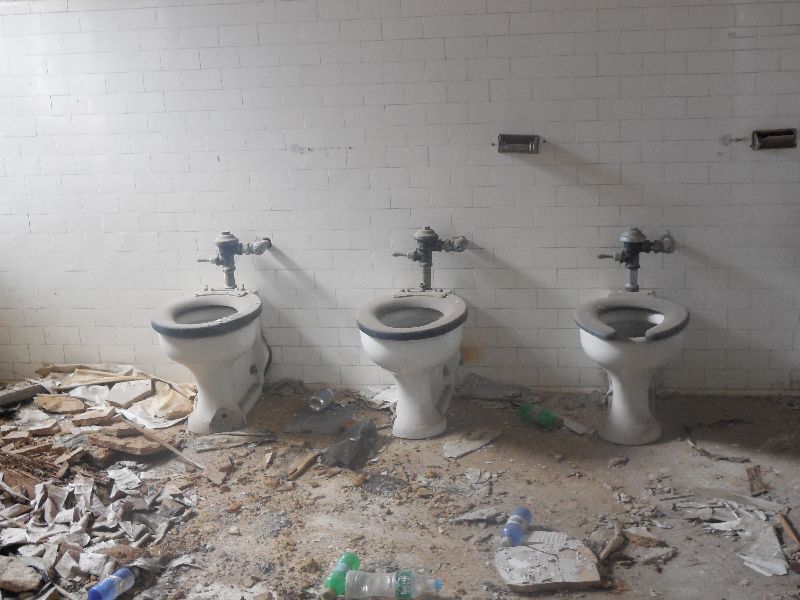
Find the location of a particular element. The width and height of the screenshot is (800, 600). bottle is located at coordinates (541, 417).